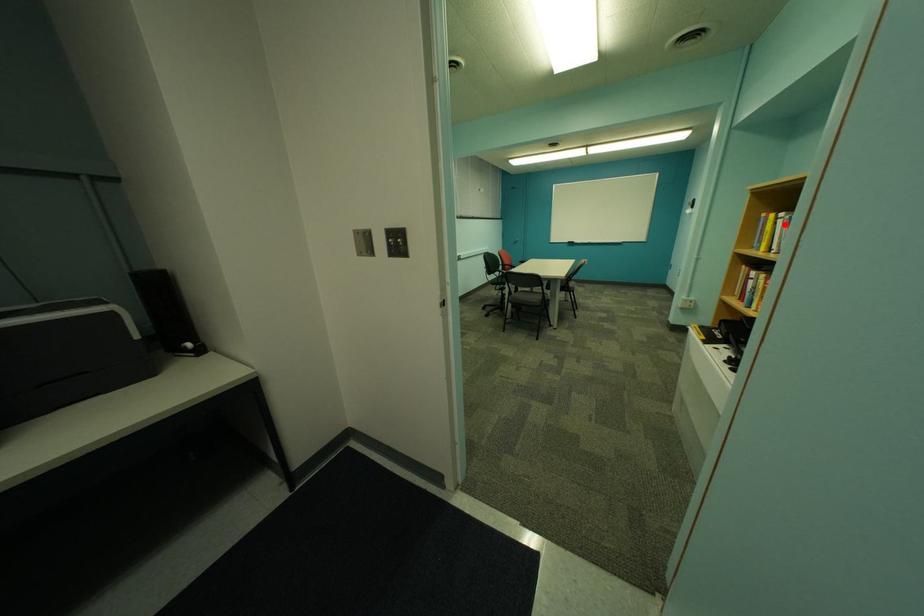
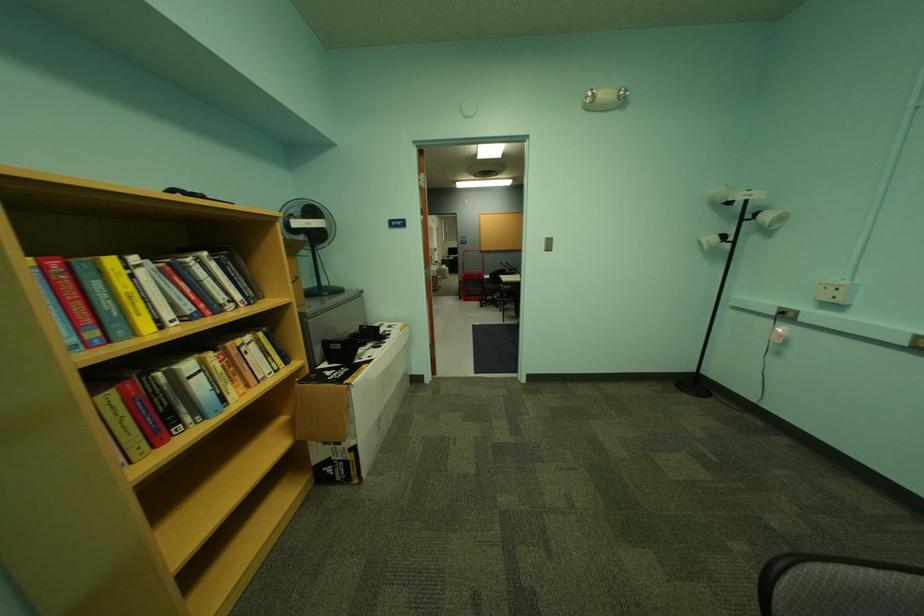
In the second image, find the point that corresponds to the highlighted location in the first image.

(140, 278)